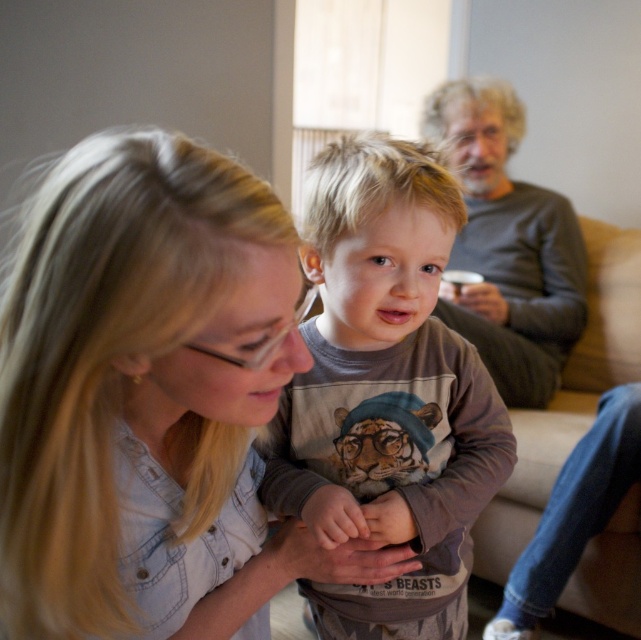
Question: Which of the following is the closest to the observer?

Choices:
 (A) (265, 387)
 (B) (401, 493)
 (C) (570, 435)
 (D) (520, 112)

Answer: (A)

Question: Can you confirm if denim shirt at center is positioned below beige fabric couch at lower right?

Choices:
 (A) yes
 (B) no

Answer: (B)

Question: Which point is closer to the camera taking this photo?

Choices:
 (A) (6, 464)
 (B) (483, 212)

Answer: (A)

Question: Is denim shirt at center smaller than brown cotton shirt at center?

Choices:
 (A) no
 (B) yes

Answer: (A)

Question: Is denim shirt at center above beige fabric couch at lower right?

Choices:
 (A) no
 (B) yes

Answer: (B)

Question: Which point is closer to the camera taking this photo?

Choices:
 (A) (78, 241)
 (B) (487, 506)
 (C) (467, 227)
 (D) (338, 189)

Answer: (A)